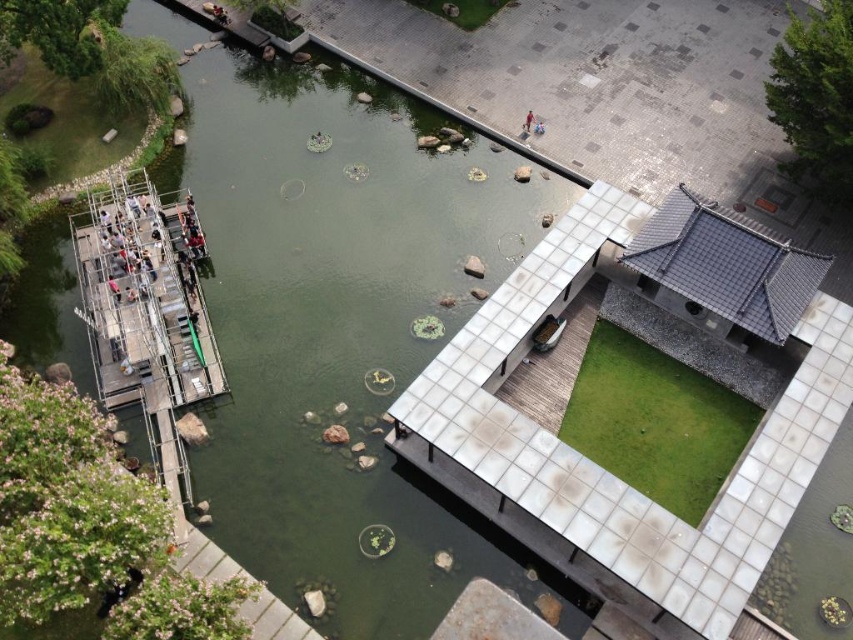
You are standing at the raised platform with a metal railing on the left side of the pond. You see two points marked in the scene. The first point is at coordinate point (91, 353) and the second is at coordinate point (524, 124). Which point is closer to your current position?

Point (91, 353) is closer to your current position because it is in front of point (524, 124).

You are a visitor standing on the metallic dock at left and want to walk to the metallic silver boat at center. Which direction should you move to reach it?

→ The metallic silver boat at center is further away from you than the metallic dock at left. To reach it, you should move forward away from your current position on the metallic dock at left toward the center of the pond.

You are a drone operator tasked with capturing aerial footage of the park. The metallic dock at left is represented by point [144,298]. If you want to fly your drone from the center of the pond to the metallic dock at left, in which general direction should you direct the drone?

The metallic dock at left is located at point [144,298], so to fly the drone from the center of the pond to the metallic dock at left, you should direct it towards the left side of the park.